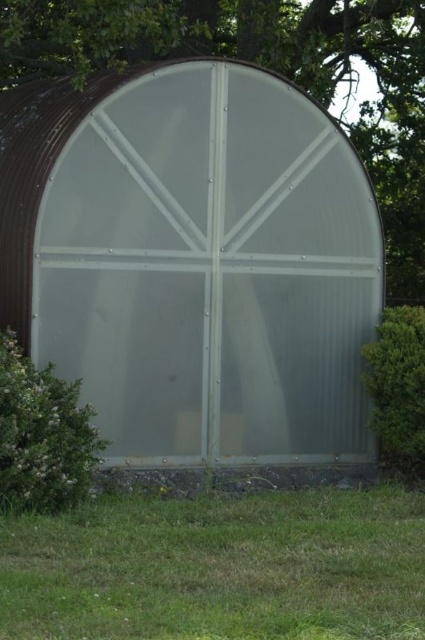
Question: Can you confirm if green grass at lower center is positioned below green leafy hedge at right?

Choices:
 (A) no
 (B) yes

Answer: (B)

Question: Which of the following is the farthest from the observer?

Choices:
 (A) (286, 612)
 (B) (405, 113)
 (C) (57, 508)
 (D) (371, 420)

Answer: (B)

Question: Which point is closer to the camera?

Choices:
 (A) (91, 176)
 (B) (33, 467)

Answer: (B)

Question: Is green grass at lower center smaller than green leafy hedge at right?

Choices:
 (A) yes
 (B) no

Answer: (B)

Question: Which point appears closest to the camera in this image?

Choices:
 (A) (0, 339)
 (B) (382, 72)

Answer: (A)

Question: Does green leafy hedge at lower left have a smaller size compared to green leafy hedge at right?

Choices:
 (A) yes
 (B) no

Answer: (B)